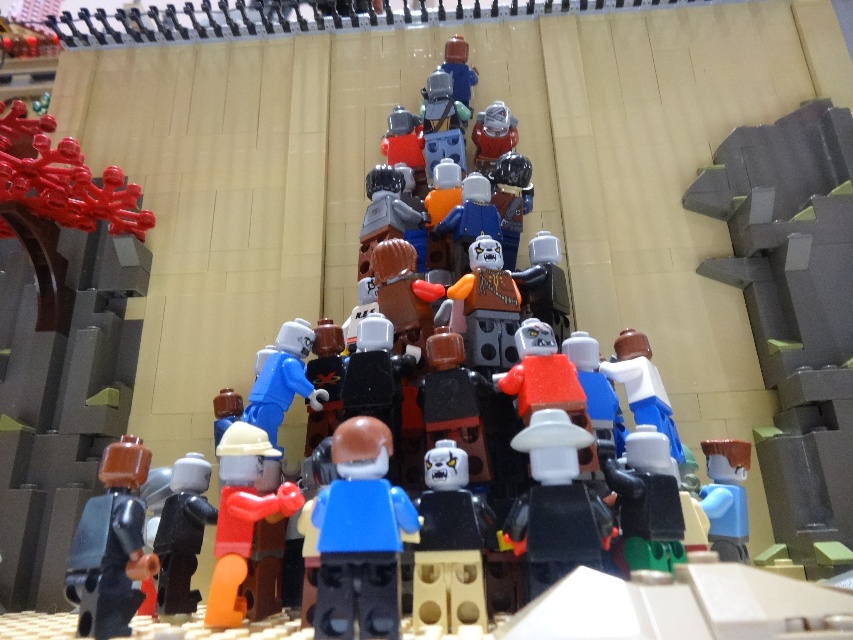
Does point (334, 611) lie behind point (648, 529)?

No, it is in front of (648, 529).

Between blue plastic figure at center and green matte minifigure at center, which one appears on the left side from the viewer's perspective?

blue plastic figure at center is more to the left.

Does point (370, 592) lie behind point (651, 531)?

No, it is in front of (651, 531).

Where is `blue plastic figure at center`? The image size is (853, 640). blue plastic figure at center is located at coordinates (358, 536).

Does point (479, 612) lie in front of point (177, 484)?

Yes, point (479, 612) is closer to viewer.

Does black matte skull head at center appear over black plastic minifigure at center?

Yes, black matte skull head at center is above black plastic minifigure at center.

You are a GUI agent. You are given a task and a screenshot of the screen. Output one action in this format:
    pyautogui.click(x=<x>, y=<y>)
    Task: Click on the black matte skull head at center
    This screenshot has height=640, width=853.
    Given the screenshot: What is the action you would take?
    pyautogui.click(x=450, y=544)

Looking at this image, between white matte cowboy hat at center and shiny silver helmet at upper center, which one has less height?

shiny silver helmet at upper center

Is point (553, 449) positioned after point (474, 141)?

No, it is in front of (474, 141).

Is point (544, 568) farther from camera compared to point (474, 152)?

That is False.

Find the location of a particular element. This screenshot has width=853, height=640. white matte cowboy hat at center is located at coordinates (555, 502).